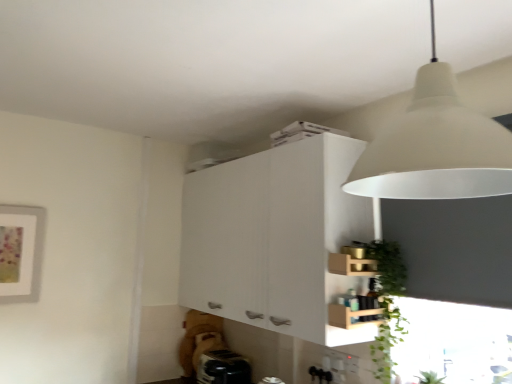
Question: Is green leafy plant at lower right positioned in front of wooden crate at lower right?

Choices:
 (A) yes
 (B) no

Answer: (A)

Question: Can you confirm if green leafy plant at lower right is thinner than wooden crate at lower right?

Choices:
 (A) yes
 (B) no

Answer: (B)

Question: Is green leafy plant at lower right smaller than wooden crate at lower right?

Choices:
 (A) yes
 (B) no

Answer: (B)

Question: Is green leafy plant at lower right oriented away from wooden crate at lower right?

Choices:
 (A) no
 (B) yes

Answer: (B)

Question: Can you see green leafy plant at lower right touching wooden crate at lower right?

Choices:
 (A) yes
 (B) no

Answer: (B)

Question: From the image's perspective, is white matte lampshade at upper right above or below wooden crate at lower right?

Choices:
 (A) above
 (B) below

Answer: (A)

Question: Considering their positions, is white matte lampshade at upper right located in front of or behind wooden crate at lower right?

Choices:
 (A) behind
 (B) front

Answer: (B)

Question: From a real-world perspective, is white matte lampshade at upper right positioned above or below wooden crate at lower right?

Choices:
 (A) above
 (B) below

Answer: (A)

Question: Considering the positions of white matte lampshade at upper right and wooden crate at lower right in the image, is white matte lampshade at upper right taller or shorter than wooden crate at lower right?

Choices:
 (A) tall
 (B) short

Answer: (A)

Question: Considering the positions of wooden crate at lower right and green leafy plant at lower right in the image, is wooden crate at lower right bigger or smaller than green leafy plant at lower right?

Choices:
 (A) small
 (B) big

Answer: (A)

Question: In the image, is wooden crate at lower right positioned in front of or behind green leafy plant at lower right?

Choices:
 (A) front
 (B) behind

Answer: (B)

Question: Considering the positions of wooden crate at lower right and green leafy plant at lower right in the image, is wooden crate at lower right taller or shorter than green leafy plant at lower right?

Choices:
 (A) tall
 (B) short

Answer: (B)

Question: From the image's perspective, is wooden crate at lower right located above or below green leafy plant at lower right?

Choices:
 (A) above
 (B) below

Answer: (A)

Question: From the image's perspective, is wooden crate at lower right located above or below black plastic toaster at lower center?

Choices:
 (A) above
 (B) below

Answer: (A)

Question: Considering the positions of wooden crate at lower right and black plastic toaster at lower center in the image, is wooden crate at lower right taller or shorter than black plastic toaster at lower center?

Choices:
 (A) tall
 (B) short

Answer: (A)